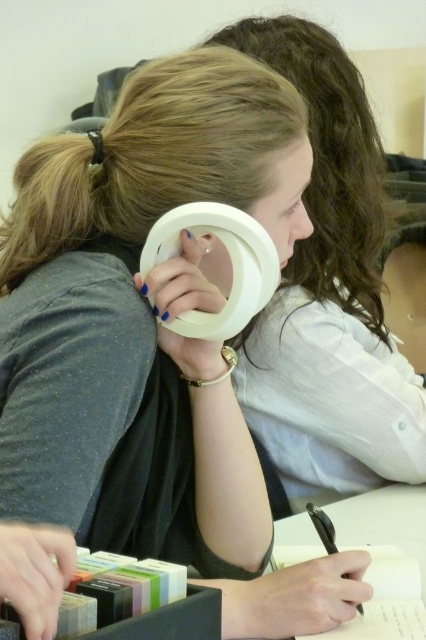
You are a student in a classroom and see the white plastic magnifying glass at upper center and the white paper at center. Which object is taller?

The white plastic magnifying glass at upper center is much taller than the white paper at center.

You are standing at point [227,237] and want to walk to point [298,352]. Is the destination point behind you or in front of you?

The destination point [298,352] is behind point [227,237], so if you are standing at point [227,237], the destination is behind you.